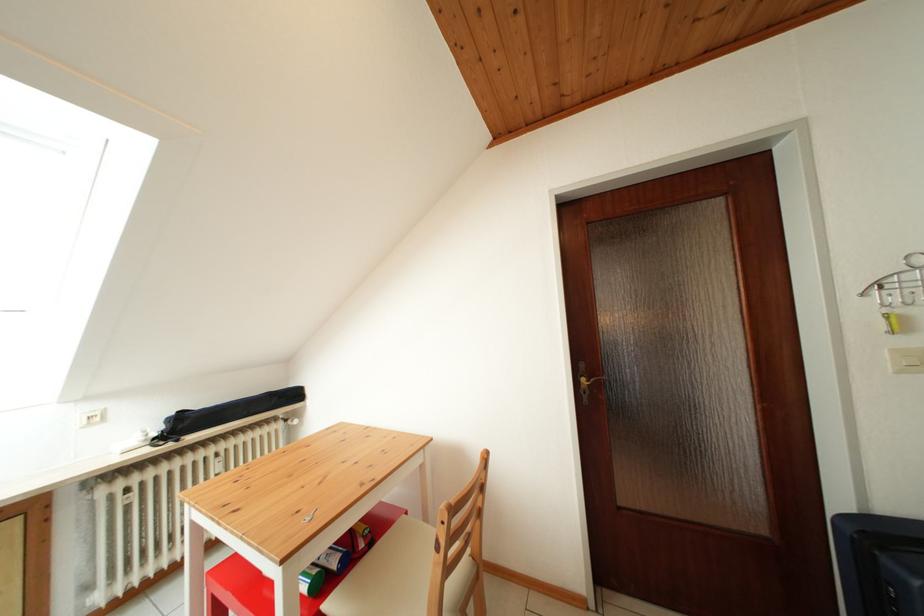
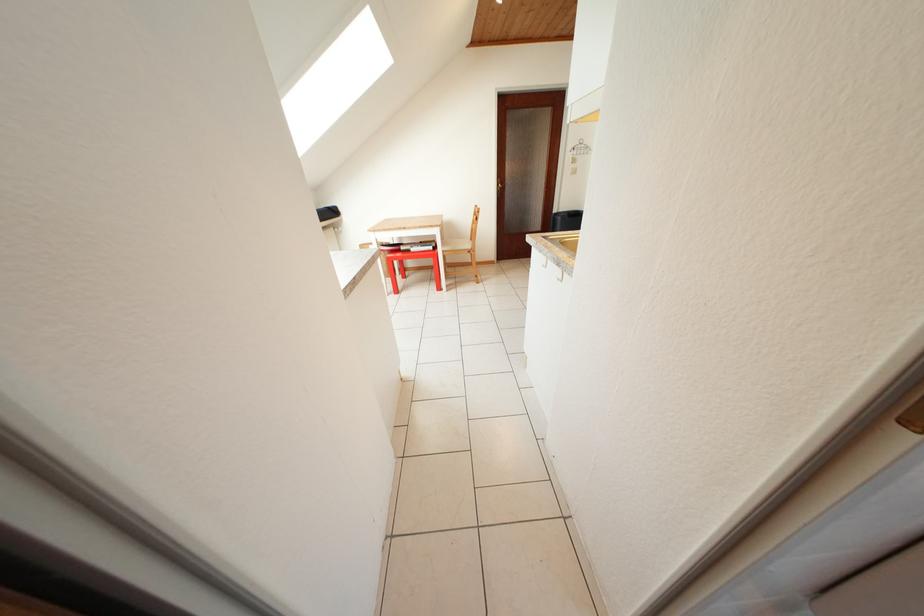
In the second image, find the point that corresponds to pixel 860 290 in the first image.

(578, 153)